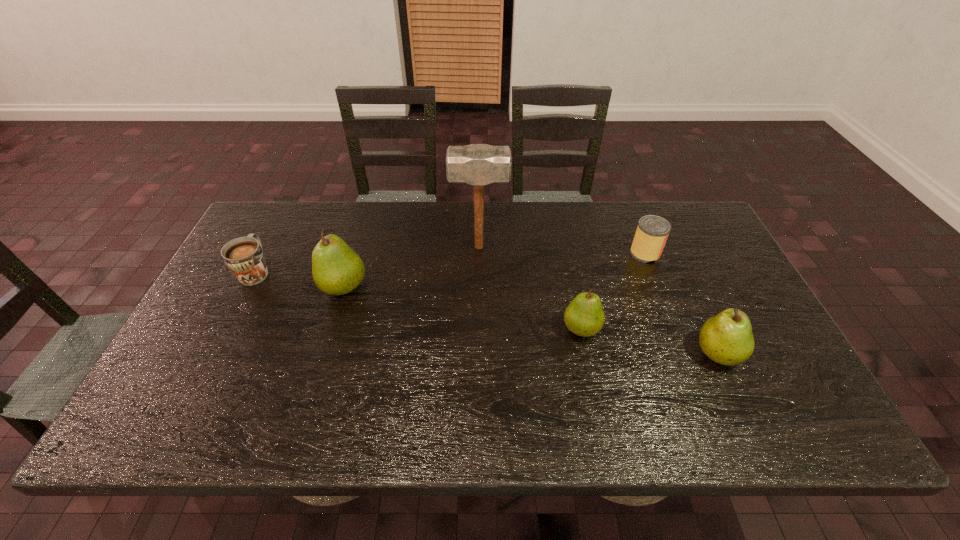
At what (x,y) coordinates should I click in order to perform the action: click on unoccupied area between the leftmost object and the rightmost pear. Please return your answer as a coordinate pair (x, y). Looking at the image, I should click on (487, 312).

You are a GUI agent. You are given a task and a screenshot of the screen. Output one action in this format:
    pyautogui.click(x=<x>, y=<y>)
    Task: Click on the free spot between the can and the leftmost object
    
    Given the screenshot: What is the action you would take?
    pyautogui.click(x=450, y=262)

Locate an element on the screen. This screenshot has height=540, width=960. vacant space that's between the mallet and the leftmost object is located at coordinates (368, 259).

Locate an element on the screen. vacant area that lies between the farthest pear and the leftmost object is located at coordinates (300, 279).

Identify the location of unoccupied area between the rightmost pear and the third shortest object. (649, 341).

In order to click on vacant space that's between the fifth object from right to left and the shortest pear in this screenshot , I will do `click(463, 308)`.

Locate an element on the screen. free spot between the farthest pear and the mallet is located at coordinates (412, 267).

At what (x,y) coordinates should I click in order to perform the action: click on free area in between the third object from left to right and the can. Please return your answer as a coordinate pair (x, y). This screenshot has width=960, height=540. Looking at the image, I should click on (562, 250).

You are a GUI agent. You are given a task and a screenshot of the screen. Output one action in this format:
    pyautogui.click(x=<x>, y=<y>)
    Task: Click on the object identified as the third closest to the second tallest pear
    
    Given the screenshot: What is the action you would take?
    pyautogui.click(x=477, y=164)

At what (x,y) coordinates should I click in order to perform the action: click on object that is the closest to the leftmost pear. Please return your answer as a coordinate pair (x, y). Image resolution: width=960 pixels, height=540 pixels. Looking at the image, I should click on (244, 256).